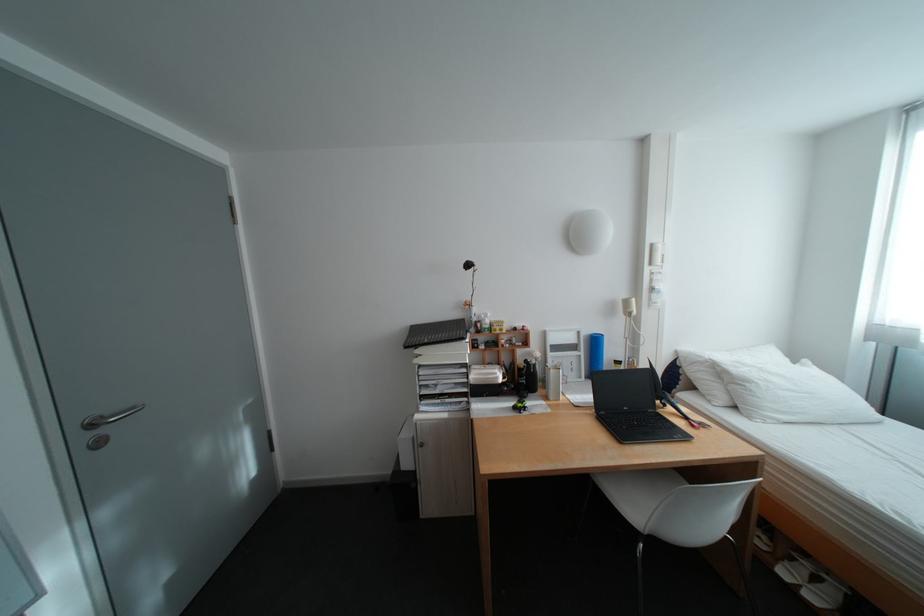
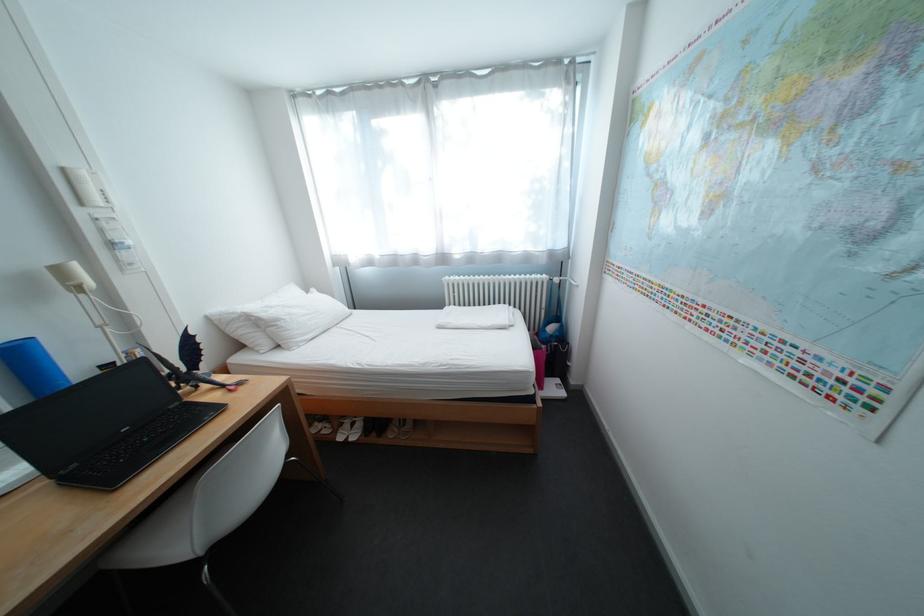
The point at (638, 302) is marked in the first image. Where is the corresponding point in the second image?

(71, 272)